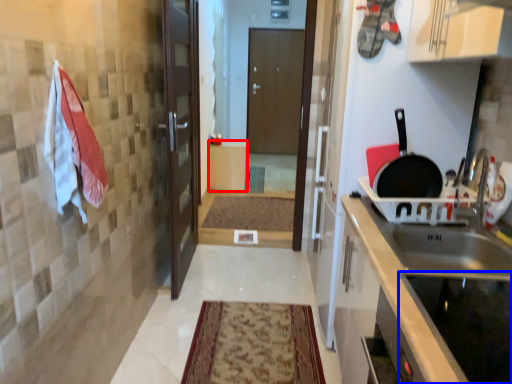
Question: Among these objects, which one is nearest to the camera, cabinetry (highlighted by a red box) or appliance (highlighted by a blue box)?

Choices:
 (A) cabinetry
 (B) appliance

Answer: (B)